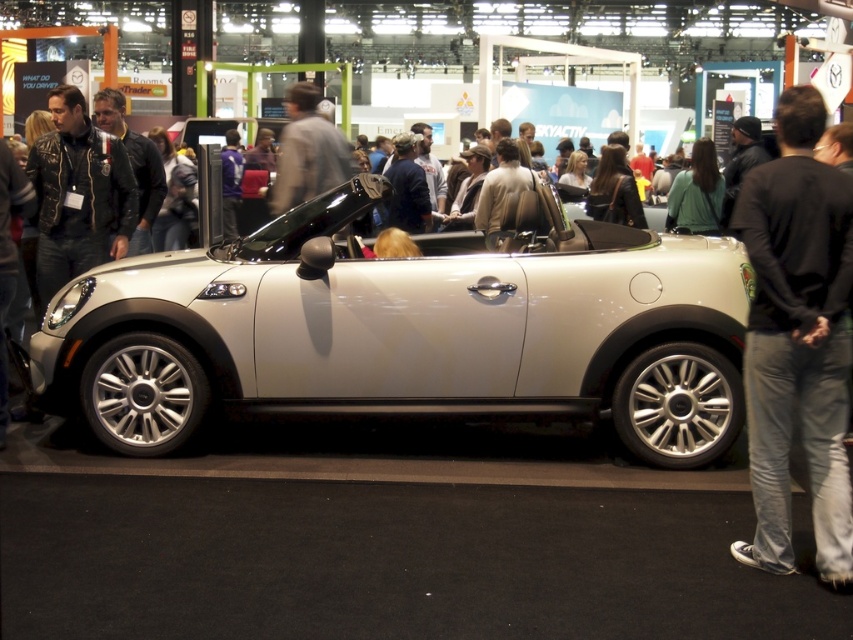
Question: Which of the following is the closest to the observer?

Choices:
 (A) (253, 257)
 (B) (102, 228)
 (C) (764, 296)

Answer: (C)

Question: Can you confirm if satin silver car at center is thinner than dark gray jeans at right?

Choices:
 (A) yes
 (B) no

Answer: (B)

Question: Which is nearer to the leather jacket at left?

Choices:
 (A) dark gray jeans at right
 (B) satin silver car at center

Answer: (B)

Question: Can you confirm if satin silver car at center is smaller than dark gray jeans at right?

Choices:
 (A) no
 (B) yes

Answer: (A)

Question: Considering the relative positions of satin silver car at center and dark gray jeans at right in the image provided, where is satin silver car at center located with respect to dark gray jeans at right?

Choices:
 (A) left
 (B) right

Answer: (A)

Question: Which point is closer to the camera?

Choices:
 (A) (831, 438)
 (B) (103, 273)
 (C) (57, 136)

Answer: (A)